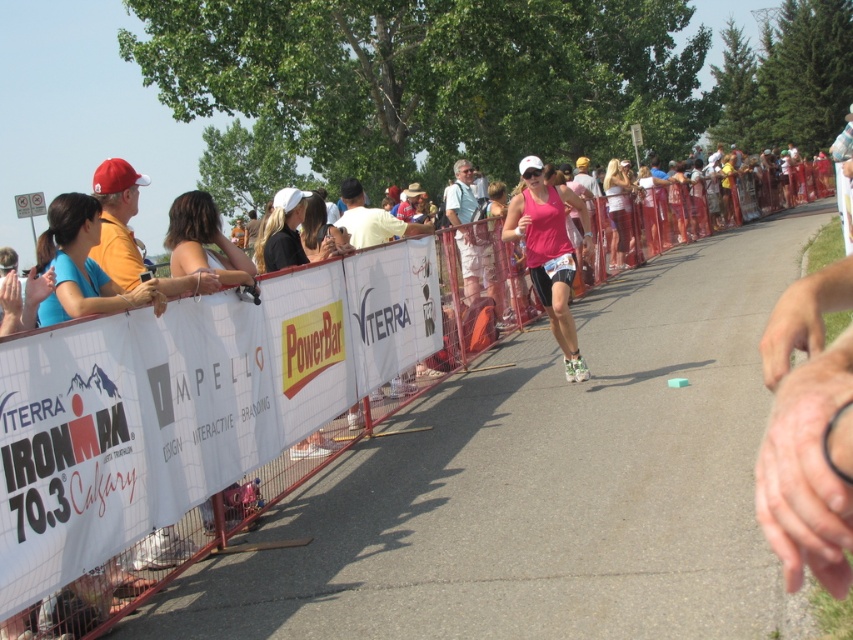
Does white plastic barrier at center appear under pink matte tank top at center?

Actually, white plastic barrier at center is above pink matte tank top at center.

This screenshot has width=853, height=640. What do you see at coordinates (160, 556) in the screenshot?
I see `white plastic barrier at center` at bounding box center [160, 556].

I want to click on white plastic barrier at center, so click(x=160, y=556).